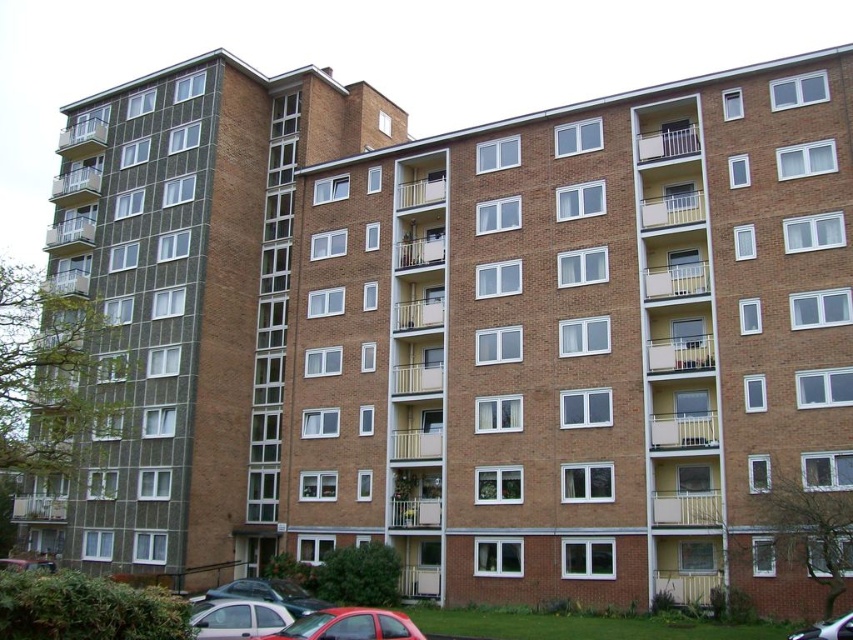
Question: Which object is positioned closest to the silver metallic car at lower left?

Choices:
 (A) metallic silver car at lower left
 (B) metallic silver car at lower center
 (C) matte red car at lower center
 (D) metallic silver car at lower right

Answer: (C)

Question: Does matte red car at lower center have a lesser width compared to metallic silver car at lower center?

Choices:
 (A) yes
 (B) no

Answer: (A)

Question: Which of the following is the farthest from the observer?

Choices:
 (A) metallic silver car at lower center
 (B) silver metallic car at lower left
 (C) matte red car at lower center
 (D) metallic silver car at lower left

Answer: (D)

Question: Observing the image, what is the correct spatial positioning of silver metallic car at lower left in reference to metallic silver car at lower right?

Choices:
 (A) left
 (B) right

Answer: (A)

Question: Which object is farther from the camera taking this photo?

Choices:
 (A) metallic silver car at lower center
 (B) metallic silver car at lower right
 (C) metallic silver car at lower left
 (D) matte red car at lower center

Answer: (C)

Question: Does silver metallic car at lower left appear on the right side of metallic silver car at lower right?

Choices:
 (A) yes
 (B) no

Answer: (B)